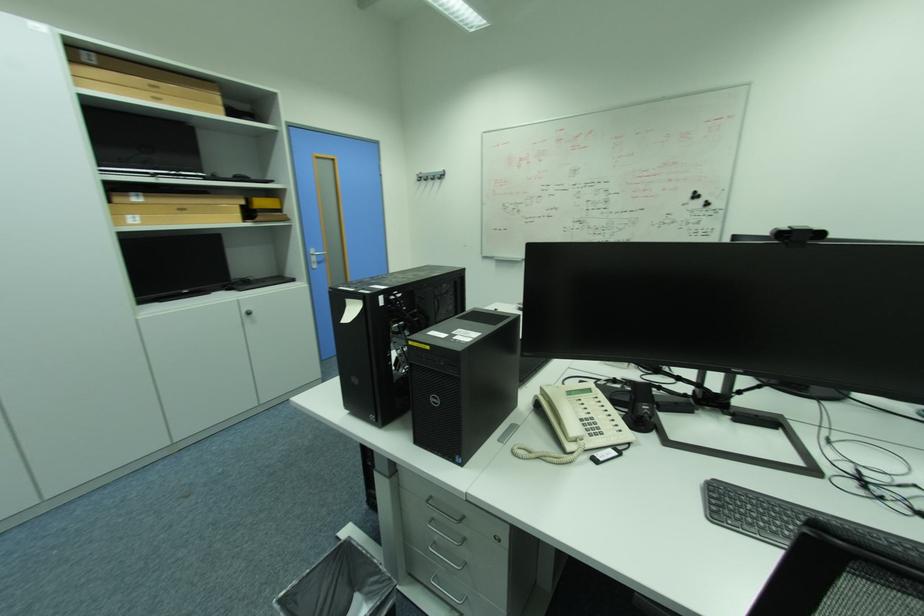
The width and height of the screenshot is (924, 616). Describe the element at coordinates (563, 411) in the screenshot. I see `the beige phone handset` at that location.